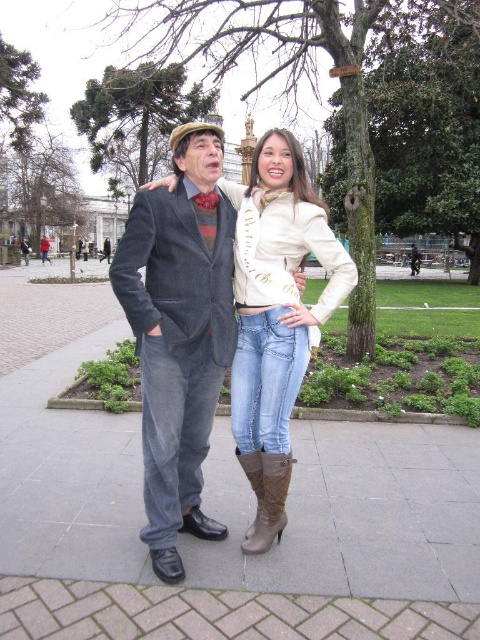
Based on the photo, who is positioned more to the left, denim jeans at center or light beige leather jacket at center?

Positioned to the left is denim jeans at center.

Does denim jeans at center appear over light beige leather jacket at center?

Yes, denim jeans at center is above light beige leather jacket at center.

Who is more forward, (282, 428) or (231, 396)?

Point (282, 428) is in front.

At what (x,y) coordinates should I click in order to perform the action: click on denim jeans at center. Please return your answer as a coordinate pair (x, y). The width and height of the screenshot is (480, 640). Looking at the image, I should click on (276, 321).

Does denim jeans at center have a smaller size compared to brown suede boot at lower center?

Incorrect, denim jeans at center is not smaller in size than brown suede boot at lower center.

Does denim jeans at center have a greater height compared to brown suede boot at lower center?

Yes, denim jeans at center is taller than brown suede boot at lower center.

The width and height of the screenshot is (480, 640). What do you see at coordinates (276, 321) in the screenshot? I see `denim jeans at center` at bounding box center [276, 321].

Identify the location of denim jeans at center. This screenshot has height=640, width=480. (276, 321).

Is light beige leather jacket at center thinner than brown suede boot at lower center?

No.

Between point (299, 320) and point (265, 500), which one is positioned behind?

The point (299, 320) is more distant.

Locate an element on the screen. light beige leather jacket at center is located at coordinates (277, 324).